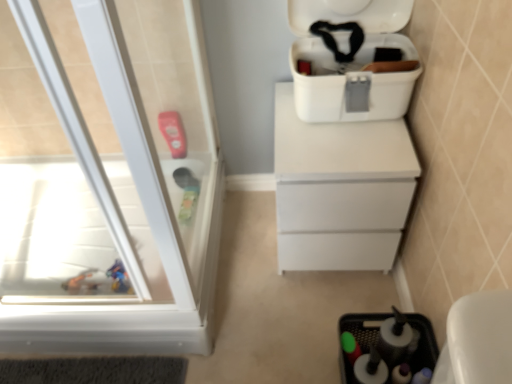
This screenshot has height=384, width=512. Describe the element at coordinates (340, 190) in the screenshot. I see `white matte chest of drawers at center` at that location.

What are the coordinates of `white plastic cooler at upper right` in the screenshot? It's located at (352, 59).

This screenshot has width=512, height=384. Describe the element at coordinates (480, 339) in the screenshot. I see `black plastic sink at lower right` at that location.

Where is `black plastic sink at lower right`? black plastic sink at lower right is located at coordinates point(480,339).

Image resolution: width=512 pixels, height=384 pixels. In order to click on white matte chest of drawers at center in this screenshot , I will do click(340, 190).

From a real-world perspective, is transparent plastic screen door at left located higher than white matte chest of drawers at center?

Yes, from a real-world perspective, transparent plastic screen door at left is over white matte chest of drawers at center

Considering the relative sizes of transparent plastic screen door at left and white matte chest of drawers at center in the image provided, is transparent plastic screen door at left taller than white matte chest of drawers at center?

Indeed, transparent plastic screen door at left has a greater height compared to white matte chest of drawers at center.

Looking at the image, does transparent plastic screen door at left seem bigger or smaller compared to white matte chest of drawers at center?

In the image, transparent plastic screen door at left appears to be smaller than white matte chest of drawers at center.

Considering the sizes of transparent plastic screen door at left and white matte chest of drawers at center in the image, is transparent plastic screen door at left wider or thinner than white matte chest of drawers at center?

Clearly, transparent plastic screen door at left has less width compared to white matte chest of drawers at center.

From the image's perspective, between transparent plastic screen door at left and black plastic sink at lower right, which one is located above?

transparent plastic screen door at left, from the image's perspective.

Can you tell me how much transparent plastic screen door at left and black plastic sink at lower right differ in facing direction?

There is a 178-degree angle between the facing directions of transparent plastic screen door at left and black plastic sink at lower right.

Based on the photo, does transparent plastic screen door at left touch black plastic sink at lower right?

transparent plastic screen door at left is not next to black plastic sink at lower right, and they're not touching.

Can you see black plastic sink at lower right touching transparent plastic screen door at left?

No, black plastic sink at lower right is not beside transparent plastic screen door at left.

From a real-world perspective, is black plastic sink at lower right above or below transparent plastic screen door at left?

Clearly, from a real-world perspective, black plastic sink at lower right is below transparent plastic screen door at left.

Between black plastic sink at lower right and transparent plastic screen door at left, which one has larger width?

With larger width is black plastic sink at lower right.

From the picture: What's the angular difference between black plastic sink at lower right and transparent plastic screen door at left's facing directions?

black plastic sink at lower right and transparent plastic screen door at left are facing 178 degrees away from each other.

Could transparent plastic screen door at left be considered to be inside white plastic cooler at upper right?

No, transparent plastic screen door at left is not surrounded by white plastic cooler at upper right.

Measure the distance from white plastic cooler at upper right to transparent plastic screen door at left.

The distance of white plastic cooler at upper right from transparent plastic screen door at left is 26.07 inches.

Image resolution: width=512 pixels, height=384 pixels. In the image, there is a transparent plastic screen door at left. Identify the location of cooler above it (from the image's perspective). (352, 59).

Can you confirm if white plastic cooler at upper right is bigger than transparent plastic screen door at left?

Indeed, white plastic cooler at upper right has a larger size compared to transparent plastic screen door at left.

In terms of size, does white matte chest of drawers at center appear bigger or smaller than black plastic sink at lower right?

In the image, white matte chest of drawers at center appears to be larger than black plastic sink at lower right.

Considering their positions, is white matte chest of drawers at center located in front of or behind black plastic sink at lower right?

Visually, white matte chest of drawers at center is located behind black plastic sink at lower right.

Is white matte chest of drawers at center positioned with its back to black plastic sink at lower right?

That's not correct — white matte chest of drawers at center is not looking away from black plastic sink at lower right.

Which object is thinner, white matte chest of drawers at center or black plastic sink at lower right?

Thinner between the two is black plastic sink at lower right.

Can you tell me how much transparent plastic screen door at left and white plastic cooler at upper right differ in facing direction?

There is a 92.5-degree angle between the facing directions of transparent plastic screen door at left and white plastic cooler at upper right.

Which is correct: transparent plastic screen door at left is inside white plastic cooler at upper right, or outside of it?

transparent plastic screen door at left cannot be found inside white plastic cooler at upper right.

Considering the sizes of objects transparent plastic screen door at left and white plastic cooler at upper right in the image provided, who is taller, transparent plastic screen door at left or white plastic cooler at upper right?

transparent plastic screen door at left is taller.

Is point (144, 89) less distant than point (307, 42)?

That is False.

Consider the image. Considering the positions of objects white plastic cooler at upper right and white matte chest of drawers at center in the image provided, who is in front, white plastic cooler at upper right or white matte chest of drawers at center?

white plastic cooler at upper right is more forward.

Is white matte chest of drawers at center completely or partially inside white plastic cooler at upper right?

No, white matte chest of drawers at center is not inside white plastic cooler at upper right.

Is white plastic cooler at upper right aimed at white matte chest of drawers at center?

No, white plastic cooler at upper right is not aimed at white matte chest of drawers at center.

From the image's perspective, does white plastic cooler at upper right appear lower than white matte chest of drawers at center?

Incorrect, from the image's perspective, white plastic cooler at upper right is higher than white matte chest of drawers at center.

Where is `the chest of drawers located behind the transparent plastic screen door at left`? the chest of drawers located behind the transparent plastic screen door at left is located at coordinates (340, 190).

The width and height of the screenshot is (512, 384). In order to click on sink located below the transparent plastic screen door at left (from the image's perspective) in this screenshot , I will do `click(480, 339)`.

Estimate the real-world distances between objects in this image. Which object is further from white plastic cooler at upper right, black plastic sink at lower right or transparent plastic screen door at left?

The object further to white plastic cooler at upper right is black plastic sink at lower right.

Considering their positions, is black plastic sink at lower right positioned further to transparent plastic screen door at left than white plastic cooler at upper right?

The object further to transparent plastic screen door at left is black plastic sink at lower right.

Which object lies nearer to the anchor point white matte chest of drawers at center, transparent plastic screen door at left or black plastic sink at lower right?

black plastic sink at lower right lies closer to white matte chest of drawers at center than the other object.

Estimate the real-world distances between objects in this image. Which object is closer to white plastic cooler at upper right, transparent plastic screen door at left or white matte chest of drawers at center?

white matte chest of drawers at center lies closer to white plastic cooler at upper right than the other object.

Which object lies nearer to the anchor point white plastic cooler at upper right, white matte chest of drawers at center or transparent plastic screen door at left?

white matte chest of drawers at center is closer to white plastic cooler at upper right.

Estimate the real-world distances between objects in this image. Which object is further from black plastic sink at lower right, transparent plastic screen door at left or white matte chest of drawers at center?

transparent plastic screen door at left is positioned further to the anchor black plastic sink at lower right.

Estimate the real-world distances between objects in this image. Which object is further from transparent plastic screen door at left, white matte chest of drawers at center or black plastic sink at lower right?

black plastic sink at lower right.

Which object lies further to the anchor point black plastic sink at lower right, white plastic cooler at upper right or white matte chest of drawers at center?

white plastic cooler at upper right.

I want to click on the chest of drawers that lies between white plastic cooler at upper right and black plastic sink at lower right from top to bottom, so click(340, 190).

What are the coordinates of `screen door between white plastic cooler at upper right and black plastic sink at lower right vertically` in the screenshot? It's located at (106, 182).

Identify the location of cooler located between transparent plastic screen door at left and white matte chest of drawers at center in the left-right direction. This screenshot has height=384, width=512. (352, 59).

Where is `the chest of drawers between transparent plastic screen door at left and black plastic sink at lower right vertically`? The height and width of the screenshot is (384, 512). the chest of drawers between transparent plastic screen door at left and black plastic sink at lower right vertically is located at coordinates (340, 190).